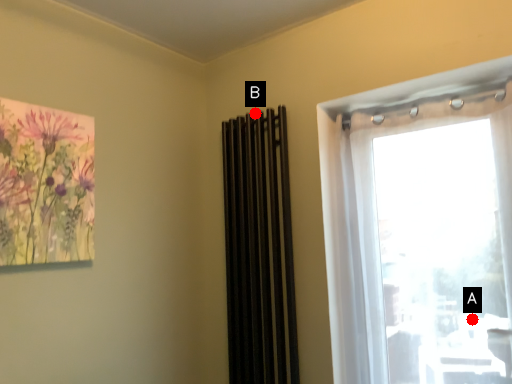
Question: Two points are circled on the image, labeled by A and B beside each circle. Which point is further to the camera?

Choices:
 (A) A is further
 (B) B is further

Answer: (B)